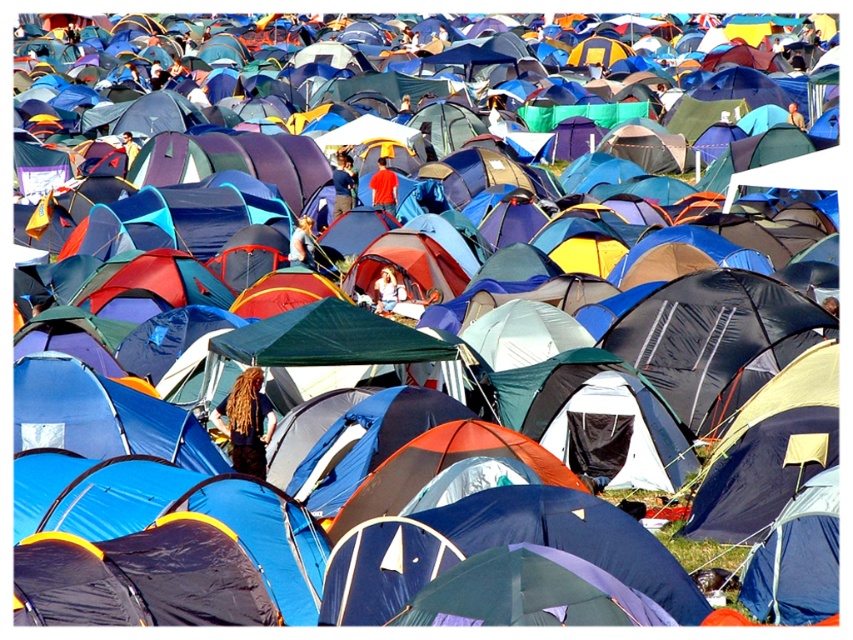
Does point (267, 404) come closer to viewer compared to point (350, 170)?

Yes, it is in front of point (350, 170).

Which of these two, dark blue fabric person at center or brown hair at center, stands taller?

dark blue fabric person at center

The image size is (853, 640). I want to click on dark blue fabric person at center, so click(247, 422).

Does light blue fabric tent at center appear on the right side of red fabric tent at center?

In fact, light blue fabric tent at center is to the left of red fabric tent at center.

Which is behind, point (386, 305) or point (793, 116)?

The point (793, 116) is more distant.

Locate an element on the screen. light blue fabric tent at center is located at coordinates (386, 291).

Where is `light blue fabric tent at center`? The image size is (853, 640). light blue fabric tent at center is located at coordinates click(x=386, y=291).

Which is in front, point (374, 193) or point (793, 113)?

Point (374, 193) is in front.

Does matte red shirt at center have a smaller size compared to red fabric tent at center?

Incorrect, matte red shirt at center is not smaller in size than red fabric tent at center.

Image resolution: width=853 pixels, height=640 pixels. Describe the element at coordinates (383, 188) in the screenshot. I see `matte red shirt at center` at that location.

Identify the location of matte red shirt at center. The width and height of the screenshot is (853, 640). (383, 188).